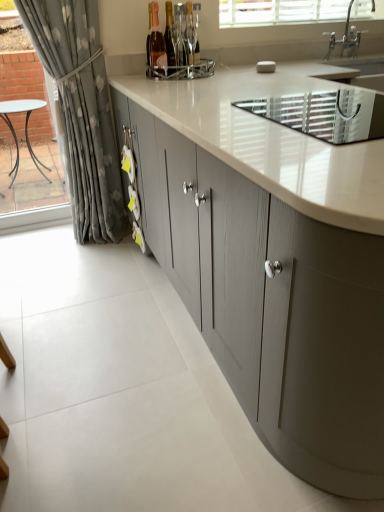
Find the location of `blank space to the left of gray floral fabric curtain at left`. blank space to the left of gray floral fabric curtain at left is located at coordinates (32, 246).